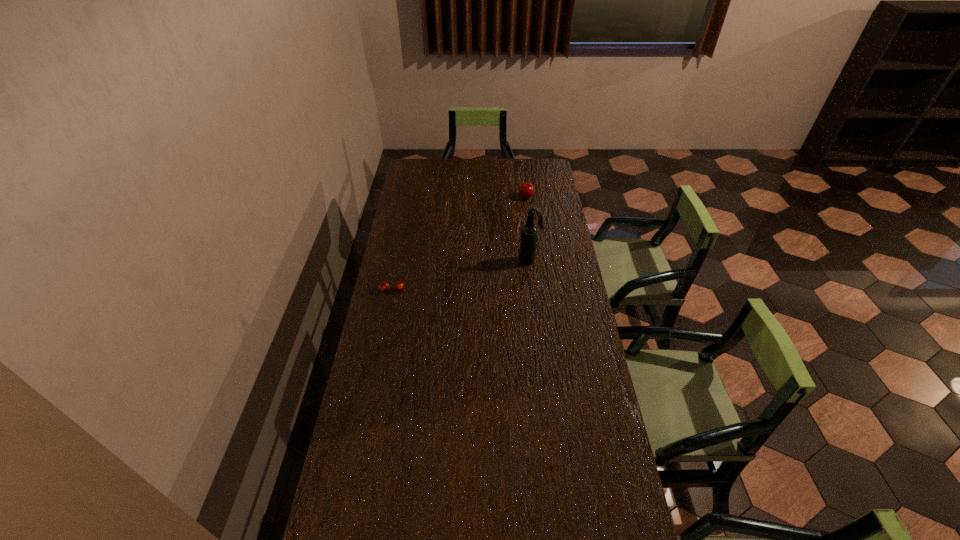
Locate an element on the screen. The image size is (960, 540). beer bottle situated at the right edge is located at coordinates (528, 239).

Locate an element on the screen. This screenshot has width=960, height=540. cherry that is at the right edge is located at coordinates (526, 190).

The height and width of the screenshot is (540, 960). In order to click on vacant space at the left edge of the desktop in this screenshot , I will do `click(427, 201)`.

Locate an element on the screen. The width and height of the screenshot is (960, 540). blank space at the right edge is located at coordinates (554, 291).

The height and width of the screenshot is (540, 960). In the image, there is a desktop. What are the coordinates of `vacant area at the far left corner` in the screenshot? It's located at (428, 168).

You are a GUI agent. You are given a task and a screenshot of the screen. Output one action in this format:
    pyautogui.click(x=<x>, y=<y>)
    Task: Click on the blank region between the nearer cherry and the farther cherry
    The width and height of the screenshot is (960, 540).
    Given the screenshot: What is the action you would take?
    pyautogui.click(x=459, y=244)

This screenshot has width=960, height=540. I want to click on vacant space in between the farthest object and the nearest object, so click(459, 244).

This screenshot has width=960, height=540. Find the location of `vacant area that lies between the farther cherry and the nearer cherry`. vacant area that lies between the farther cherry and the nearer cherry is located at coordinates [x=459, y=244].

Locate an element on the screen. This screenshot has height=540, width=960. empty space between the left cherry and the farthest object is located at coordinates (459, 244).

At what (x,y) coordinates should I click in order to perform the action: click on object that is the second closest one to the beer bottle. Please return your answer as a coordinate pair (x, y). This screenshot has height=540, width=960. Looking at the image, I should click on (383, 286).